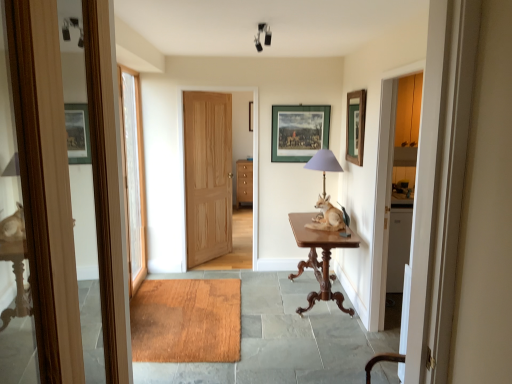
Question: From the image's perspective, is mahogany wood table at center above matte purple glass table lamp at center?

Choices:
 (A) no
 (B) yes

Answer: (A)

Question: Would you say mahogany wood table at center is a long distance from matte purple glass table lamp at center?

Choices:
 (A) yes
 (B) no

Answer: (B)

Question: Is mahogany wood table at center facing away from matte purple glass table lamp at center?

Choices:
 (A) no
 (B) yes

Answer: (A)

Question: From a real-world perspective, is mahogany wood table at center positioned under matte purple glass table lamp at center based on gravity?

Choices:
 (A) yes
 (B) no

Answer: (A)

Question: Does mahogany wood table at center have a lesser height compared to matte purple glass table lamp at center?

Choices:
 (A) no
 (B) yes

Answer: (A)

Question: Is matte purple glass table lamp at center situated inside green matte picture frame at center, which is the second picture frame in front-to-back order, or outside?

Choices:
 (A) outside
 (B) inside

Answer: (A)

Question: Is matte purple glass table lamp at center wider or thinner than green matte picture frame at center, acting as the first picture frame starting from the left?

Choices:
 (A) thin
 (B) wide

Answer: (B)

Question: From the image's perspective, is matte purple glass table lamp at center positioned above or below green matte picture frame at center, acting as the first picture frame starting from the left?

Choices:
 (A) below
 (B) above

Answer: (A)

Question: Relative to green matte picture frame at center, which is counted as the second picture frame, starting from the right, is matte purple glass table lamp at center in front or behind?

Choices:
 (A) front
 (B) behind

Answer: (A)

Question: Is brown wooden table at center taller or shorter than white glass door at left, acting as the first door starting from the left?

Choices:
 (A) short
 (B) tall

Answer: (A)

Question: In terms of width, does brown wooden table at center look wider or thinner when compared to white glass door at left, the 2th door positioned from the right?

Choices:
 (A) wide
 (B) thin

Answer: (A)

Question: From a real-world perspective, relative to white glass door at left, positioned as the second door in back-to-front order, is brown wooden table at center vertically above or below?

Choices:
 (A) above
 (B) below

Answer: (B)

Question: Is point (308, 226) positioned closer to the camera than point (140, 180)?

Choices:
 (A) closer
 (B) farther

Answer: (A)

Question: Considering the relative positions of wooden mat at center and mahogany wood table at center in the image provided, is wooden mat at center to the left or to the right of mahogany wood table at center?

Choices:
 (A) left
 (B) right

Answer: (A)

Question: Is wooden mat at center bigger or smaller than mahogany wood table at center?

Choices:
 (A) big
 (B) small

Answer: (B)